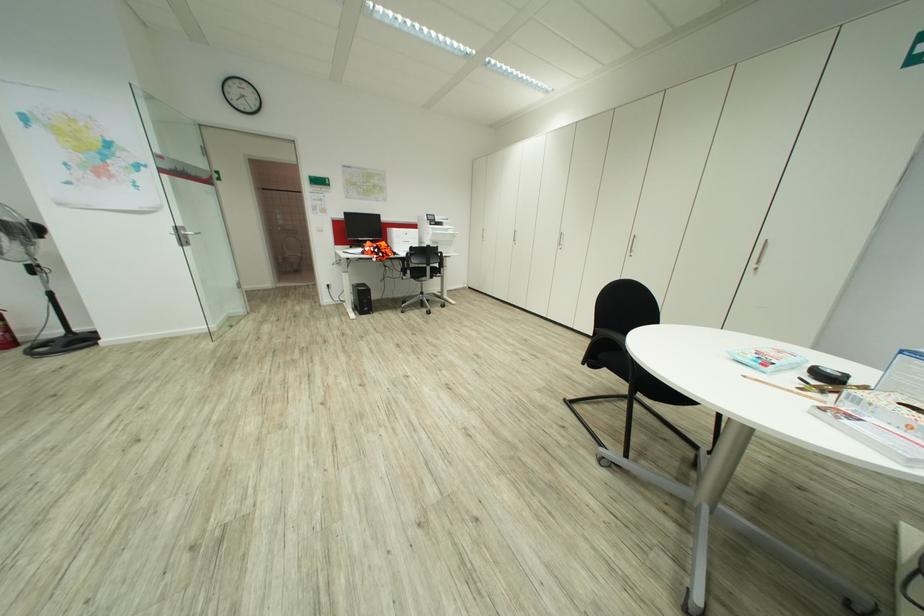
Locate an element on the screen. wooden pencil is located at coordinates (784, 389).